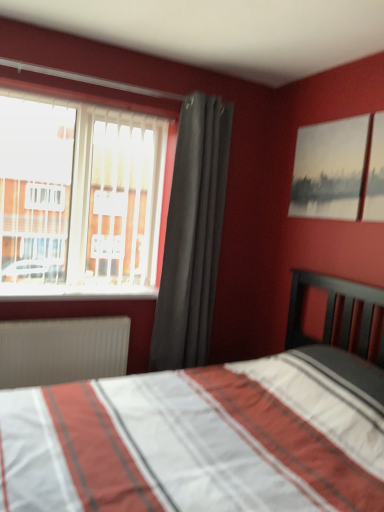
Find the location of a particular element. dark gray fabric curtain at center is located at coordinates (193, 234).

At what (x,y) coordinates should I click in order to perform the action: click on white plastic window sill at left. Please return your answer as a coordinate pair (x, y). The height and width of the screenshot is (512, 384). Looking at the image, I should click on (75, 292).

Locate an element on the screen. The height and width of the screenshot is (512, 384). matte gray painting at upper right is located at coordinates (331, 169).

In order to face gray ribbed radiator at lower left, should I rotate leftwards or rightwards?

To align with it, rotate left about 15.733°.

Measure the distance between gray ribbed radiator at lower left and camera.

7.61 feet.

Locate an element on the screen. The image size is (384, 512). transparent glass window at upper left is located at coordinates (81, 198).

Is dark gray fabric curtain at center located within matte gray painting at upper right?

That's incorrect, dark gray fabric curtain at center is not inside matte gray painting at upper right.

Considering the sizes of matte gray painting at upper right and dark gray fabric curtain at center in the image, is matte gray painting at upper right taller or shorter than dark gray fabric curtain at center?

matte gray painting at upper right is shorter than dark gray fabric curtain at center.

Considering the sizes of objects matte gray painting at upper right and dark gray fabric curtain at center in the image provided, who is thinner, matte gray painting at upper right or dark gray fabric curtain at center?

matte gray painting at upper right is thinner.

Based on the photo, how many degrees apart are the facing directions of matte gray painting at upper right and dark gray fabric curtain at center?

There is a 90.8-degree angle between the facing directions of matte gray painting at upper right and dark gray fabric curtain at center.

Considering the positions of objects white plastic window sill at left and gray ribbed radiator at lower left in the image provided, who is more to the right, white plastic window sill at left or gray ribbed radiator at lower left?

white plastic window sill at left.

From the image's perspective, between white plastic window sill at left and gray ribbed radiator at lower left, who is located below?

gray ribbed radiator at lower left, from the image's perspective.

What's the angular difference between white plastic window sill at left and gray ribbed radiator at lower left's facing directions?

white plastic window sill at left and gray ribbed radiator at lower left are facing 0.329 degrees away from each other.

In the scene shown: In terms of width, does white plastic window sill at left look wider or thinner when compared to dark gray fabric curtain at center?

In the image, white plastic window sill at left appears to be wider than dark gray fabric curtain at center.

Which is less distant, (18, 297) or (161, 326)?

The point (18, 297) is in front.

Would you say white plastic window sill at left is to the left or to the right of dark gray fabric curtain at center in the picture?

In the image, white plastic window sill at left appears on the left side of dark gray fabric curtain at center.

Considering the relative positions of transparent glass window at upper left and matte gray painting at upper right in the image provided, is transparent glass window at upper left to the left of matte gray painting at upper right from the viewer's perspective?

Correct, you'll find transparent glass window at upper left to the left of matte gray painting at upper right.

Considering the relative sizes of transparent glass window at upper left and matte gray painting at upper right in the image provided, is transparent glass window at upper left bigger than matte gray painting at upper right?

Yes, transparent glass window at upper left is bigger than matte gray painting at upper right.

Is transparent glass window at upper left directly adjacent to matte gray painting at upper right?

They are not placed beside each other.

Where is `window lying in front of the matte gray painting at upper right`? window lying in front of the matte gray painting at upper right is located at coordinates (81, 198).

Could you tell me if white plastic window sill at left is turned towards transparent glass window at upper left?

Yes, white plastic window sill at left is aimed at transparent glass window at upper left.

Image resolution: width=384 pixels, height=512 pixels. In order to click on window lying above the white plastic window sill at left (from the image's perspective) in this screenshot , I will do `click(81, 198)`.

Which of these two, white plastic window sill at left or transparent glass window at upper left, is thinner?

transparent glass window at upper left is thinner.

Is gray ribbed radiator at lower left looking in the opposite direction of transparent glass window at upper left?

No, gray ribbed radiator at lower left is not facing the opposite direction of transparent glass window at upper left.

Does point (14, 331) lie in front of point (159, 158)?

Yes, point (14, 331) is in front of point (159, 158).

In the scene shown: Considering the sizes of objects gray ribbed radiator at lower left and transparent glass window at upper left in the image provided, who is shorter, gray ribbed radiator at lower left or transparent glass window at upper left?

Standing shorter between the two is gray ribbed radiator at lower left.

From the picture: Would you say gray ribbed radiator at lower left is to the left or to the right of transparent glass window at upper left in the picture?

gray ribbed radiator at lower left is positioned on transparent glass window at upper left's left side.

Which object is further away from the camera, gray ribbed radiator at lower left or white plastic window sill at left?

white plastic window sill at left is further from the camera.

Which object is wider, gray ribbed radiator at lower left or white plastic window sill at left?

Wider between the two is white plastic window sill at left.

Who is smaller, gray ribbed radiator at lower left or white plastic window sill at left?

white plastic window sill at left is smaller.

Is gray ribbed radiator at lower left completely or partially outside of white plastic window sill at left?

Yes, gray ribbed radiator at lower left is located beyond the bounds of white plastic window sill at left.

This screenshot has width=384, height=512. In order to click on curtain lying on the left of matte gray painting at upper right in this screenshot , I will do `click(193, 234)`.

This screenshot has height=512, width=384. I want to click on radiator in front of the white plastic window sill at left, so click(62, 350).

Which object lies nearer to the anchor point matte gray painting at upper right, white plastic window sill at left or transparent glass window at upper left?

transparent glass window at upper left is closer to matte gray painting at upper right.

Based on their spatial positions, is transparent glass window at upper left or dark gray fabric curtain at center further from matte gray painting at upper right?

transparent glass window at upper left.

From the image, which object appears to be nearer to matte gray painting at upper right, transparent glass window at upper left or gray ribbed radiator at lower left?

transparent glass window at upper left.

Which object lies nearer to the anchor point matte gray painting at upper right, white plastic window sill at left or gray ribbed radiator at lower left?

Among the two, white plastic window sill at left is located nearer to matte gray painting at upper right.

Which object lies further to the anchor point gray ribbed radiator at lower left, white plastic window sill at left or matte gray painting at upper right?

matte gray painting at upper right is further to gray ribbed radiator at lower left.

Estimate the real-world distances between objects in this image. Which object is closer to white plastic window sill at left, transparent glass window at upper left or gray ribbed radiator at lower left?

Among the two, gray ribbed radiator at lower left is located nearer to white plastic window sill at left.

Considering their positions, is gray ribbed radiator at lower left positioned further to matte gray painting at upper right than transparent glass window at upper left?

Based on the image, gray ribbed radiator at lower left appears to be further to matte gray painting at upper right.

When comparing their distances from gray ribbed radiator at lower left, does dark gray fabric curtain at center or transparent glass window at upper left seem further?

dark gray fabric curtain at center is positioned further to the anchor gray ribbed radiator at lower left.

Image resolution: width=384 pixels, height=512 pixels. I want to click on window located between white plastic window sill at left and dark gray fabric curtain at center in the left-right direction, so click(x=81, y=198).

Locate an element on the screen. window located between white plastic window sill at left and matte gray painting at upper right in the left-right direction is located at coordinates (81, 198).

The image size is (384, 512). In order to click on curtain between gray ribbed radiator at lower left and matte gray painting at upper right in the horizontal direction in this screenshot , I will do `click(193, 234)`.

Where is `window sill between gray ribbed radiator at lower left and matte gray painting at upper right from left to right`? window sill between gray ribbed radiator at lower left and matte gray painting at upper right from left to right is located at coordinates (75, 292).